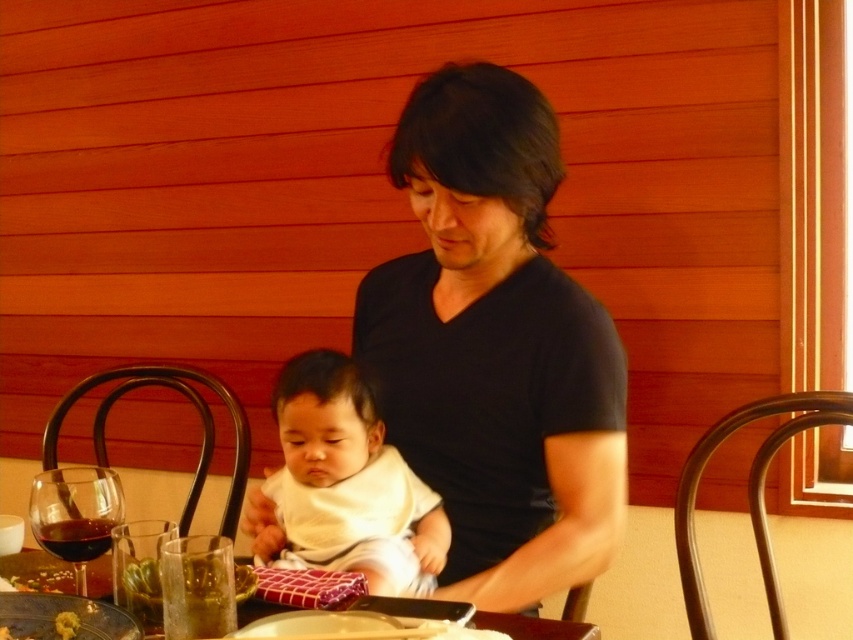
Is white soft baby at center shorter than translucent glass wine at lower left?

No, white soft baby at center is not shorter than translucent glass wine at lower left.

Who is more distant from viewer, (425, 564) or (67, 504)?

The point (425, 564) is behind.

At what (x,y) coordinates should I click in order to perform the action: click on white soft baby at center. Please return your answer as a coordinate pair (x, y). Looking at the image, I should click on (346, 484).

Does point (344, 420) come in front of point (90, 545)?

No, it is behind (90, 545).

Based on the photo, does white soft baby at center have a larger size compared to dark red glass at lower left?

Correct, white soft baby at center is larger in size than dark red glass at lower left.

What do you see at coordinates (346, 484) in the screenshot? I see `white soft baby at center` at bounding box center [346, 484].

Image resolution: width=853 pixels, height=640 pixels. Find the location of `white soft baby at center`. white soft baby at center is located at coordinates (346, 484).

Is the position of black matte shirt at center less distant than that of dark red glass at lower left?

No, black matte shirt at center is further to the viewer.

Between black matte shirt at center and dark red glass at lower left, which one has more height?

black matte shirt at center is taller.

You are a GUI agent. You are given a task and a screenshot of the screen. Output one action in this format:
    pyautogui.click(x=<x>, y=<y>)
    Task: Click on the black matte shirt at center
    The height and width of the screenshot is (640, 853).
    Given the screenshot: What is the action you would take?
    pyautogui.click(x=495, y=348)

I want to click on black matte shirt at center, so click(495, 348).